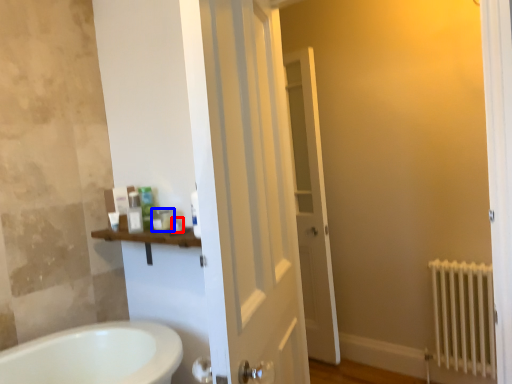
Question: Which object appears farthest to the camera in this image, toiletry (highlighted by a red box) or toiletry (highlighted by a blue box)?

Choices:
 (A) toiletry
 (B) toiletry

Answer: (B)